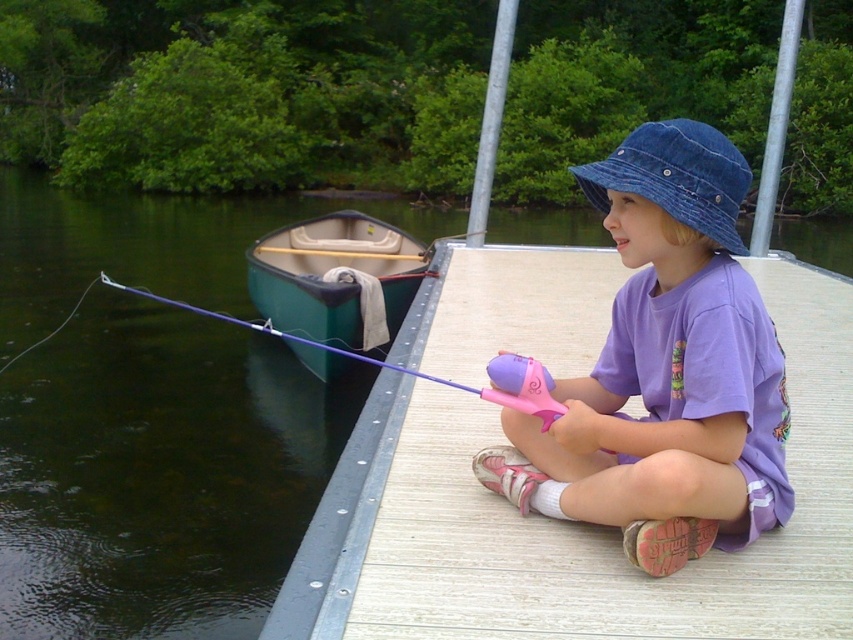
You are a photographer aiming to capture the clear water at dock left and the denim blue hat at upper center in a single frame. Based on their sizes, which object will appear bigger in the photo?

The clear water at dock left will appear bigger in the photo because it has a larger size compared to the denim blue hat at upper center.